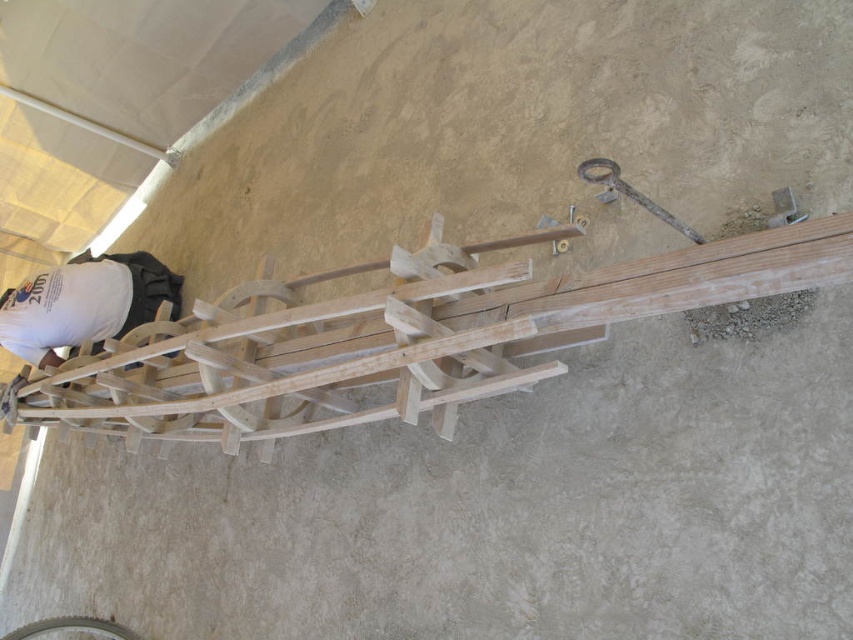
Can you confirm if natural wood rail at center is smaller than white matte shirt at upper left?

Incorrect, natural wood rail at center is not smaller in size than white matte shirt at upper left.

Is point (80, 419) behind point (28, 340)?

No, it is not.

You are a GUI agent. You are given a task and a screenshot of the screen. Output one action in this format:
    pyautogui.click(x=<x>, y=<y>)
    Task: Click on the natural wood rail at center
    The width and height of the screenshot is (853, 640).
    Given the screenshot: What is the action you would take?
    pyautogui.click(x=399, y=337)